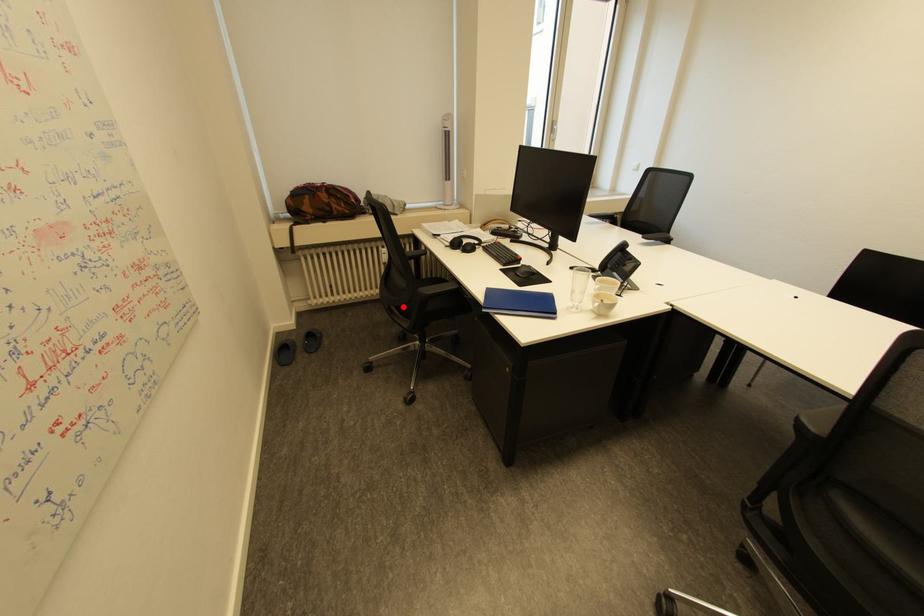
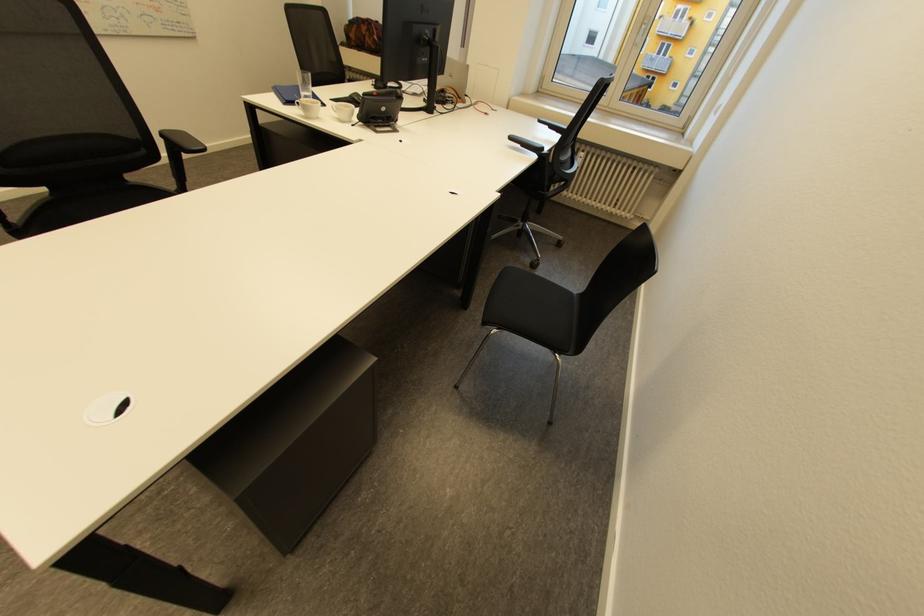
Question: I am providing you with two images of the same scene from different viewpoints. A red point is marked on the first image. Is the red point's position out of view in image 2?

Choices:
 (A) Yes
 (B) No

Answer: (A)